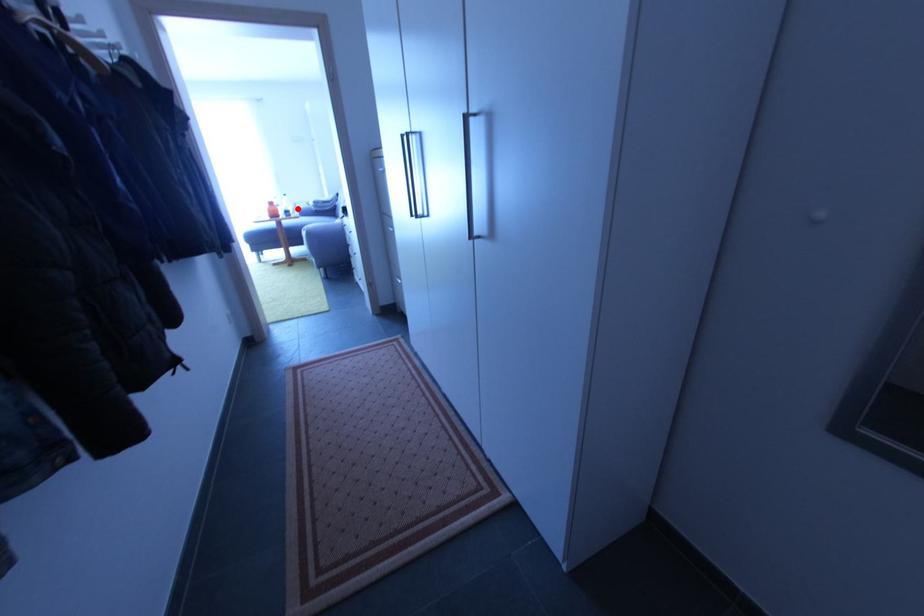
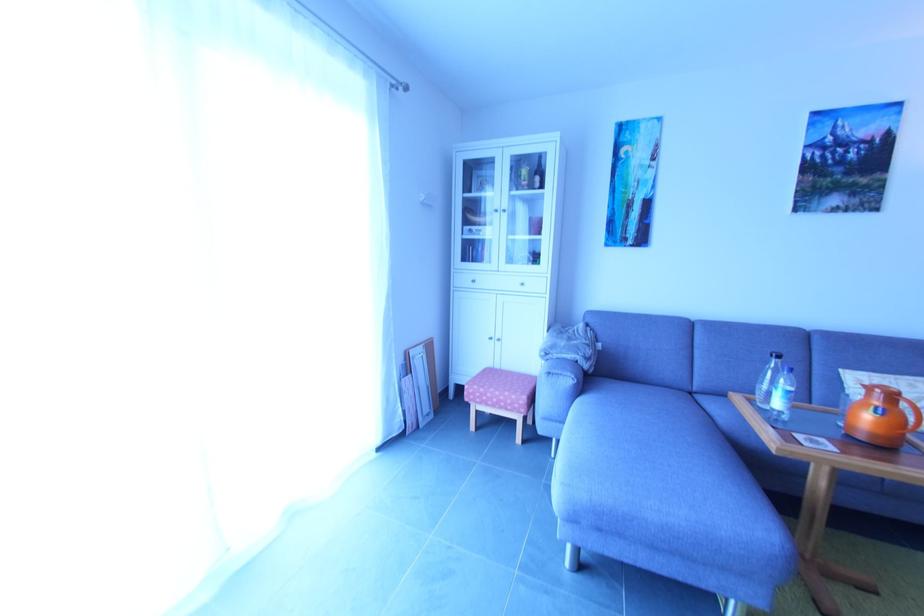
In the second image, find the point that corresponds to the highlighted location in the first image.

(406, 362)